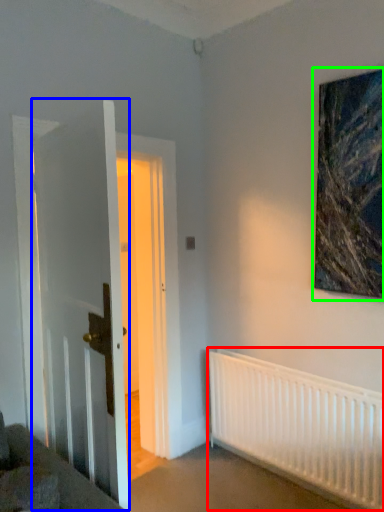
Question: Which is farther away from radiator (highlighted by a red box)? door (highlighted by a blue box) or picture frame (highlighted by a green box)?

Choices:
 (A) door
 (B) picture frame

Answer: (A)